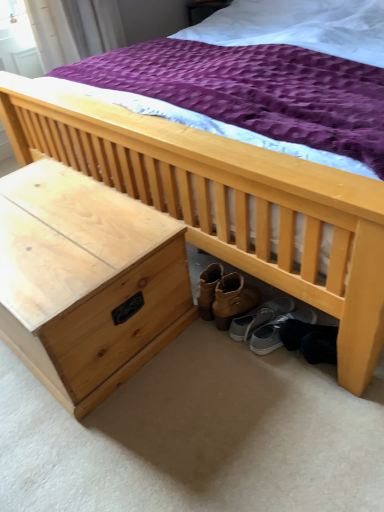
This screenshot has width=384, height=512. I want to click on empty space that is ontop of natural wood nightstand at lower left, so click(x=61, y=221).